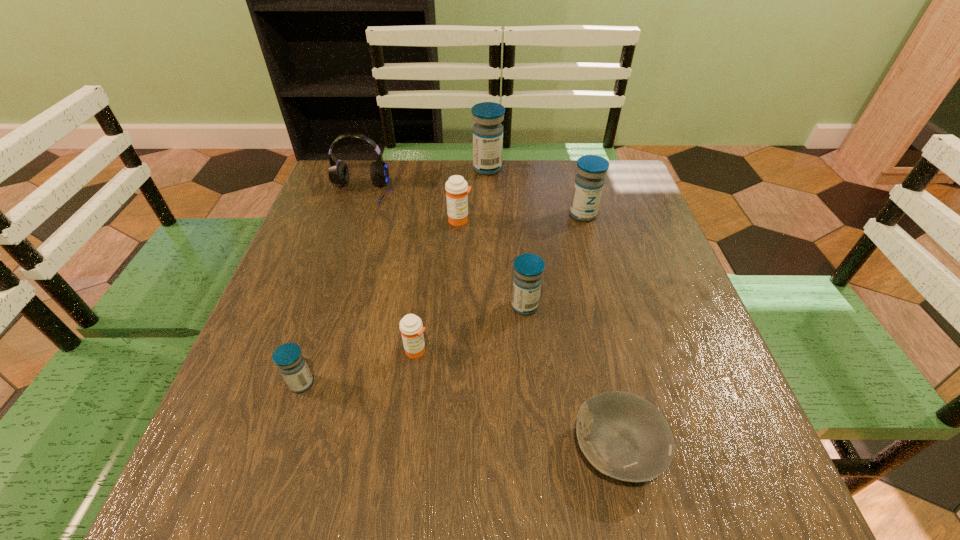
At what (x,y) coordinates should I click in order to perform the action: click on the smaller orange medicine. Please return your answer as a coordinate pair (x, y). The image size is (960, 540). Looking at the image, I should click on (411, 327).

Locate an element on the screen. the seventh farthest object is located at coordinates (288, 357).

I want to click on the leftmost medicine, so click(x=288, y=357).

In order to click on gray bowl in this screenshot , I will do [x=624, y=436].

Where is `the nearest object`? This screenshot has width=960, height=540. the nearest object is located at coordinates (624, 436).

Find the location of a particular element. This screenshot has height=540, width=960. vacant space located 0.190m on the right of the biggest blue medicine is located at coordinates (567, 168).

At what (x,y) coordinates should I click in order to perform the action: click on free space located on the ear cushions of the headset. Please return your answer as a coordinate pair (x, y). Image resolution: width=960 pixels, height=540 pixels. Looking at the image, I should click on (325, 295).

The width and height of the screenshot is (960, 540). I want to click on blank space located on the back of the rightmost blue medicine, so click(570, 166).

Where is `free point located on the right of the bigger orange medicine`? free point located on the right of the bigger orange medicine is located at coordinates (555, 220).

Identify the location of vacant point located on the front of the second smallest blue medicine. (538, 442).